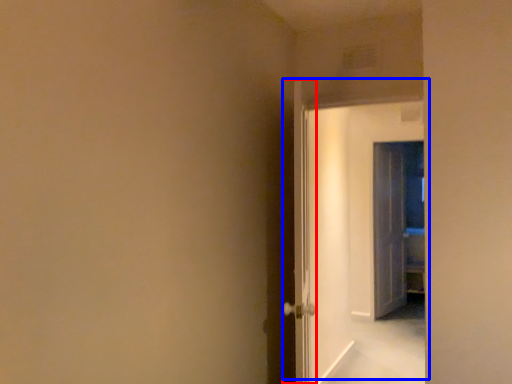
Question: Which point is closer to the camera, door (highlighted by a red box) or door (highlighted by a blue box)?

Choices:
 (A) door
 (B) door

Answer: (A)